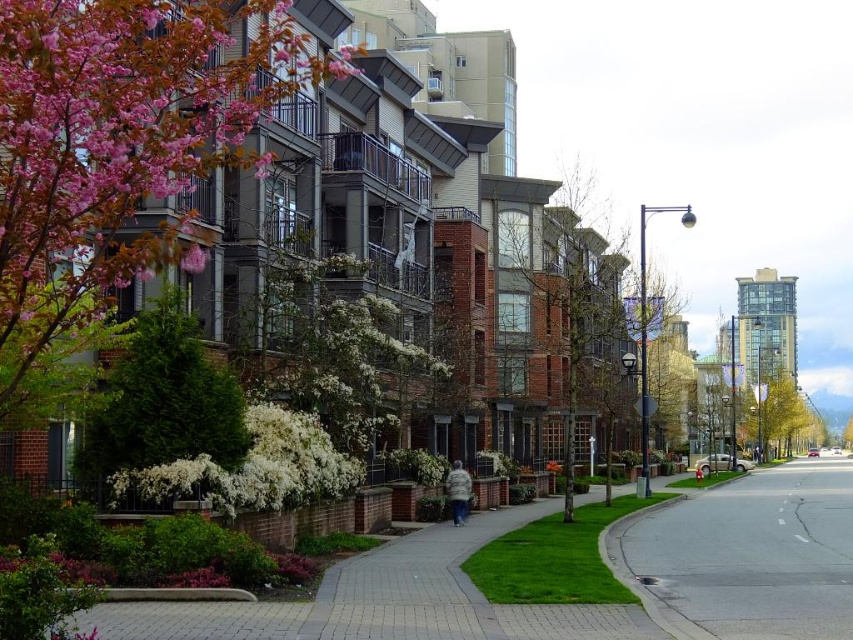
Question: Estimate the real-world distances between objects in this image. Which object is closer to the green textured bush at center?

Choices:
 (A) green leafy tree at center
 (B) paved brick sidewalk at center

Answer: (B)

Question: Considering the relative positions of pink blossoms at left and paved brick sidewalk at center in the image provided, where is pink blossoms at left located with respect to paved brick sidewalk at center?

Choices:
 (A) right
 (B) left

Answer: (B)

Question: Which of these objects is positioned farthest from the gray asphalt road at lower right?

Choices:
 (A) green textured bush at center
 (B) pink blossoms at left
 (C) green leafy tree at center

Answer: (C)

Question: Is gray asphalt road at lower right closer to the viewer compared to paved brick sidewalk at center?

Choices:
 (A) no
 (B) yes

Answer: (A)

Question: Is green leafy tree at center wider than green textured bush at center?

Choices:
 (A) no
 (B) yes

Answer: (B)

Question: Which is nearer to the pink blossoms at left?

Choices:
 (A) gray asphalt road at lower right
 (B) green leafy tree at center
 (C) paved brick sidewalk at center

Answer: (C)